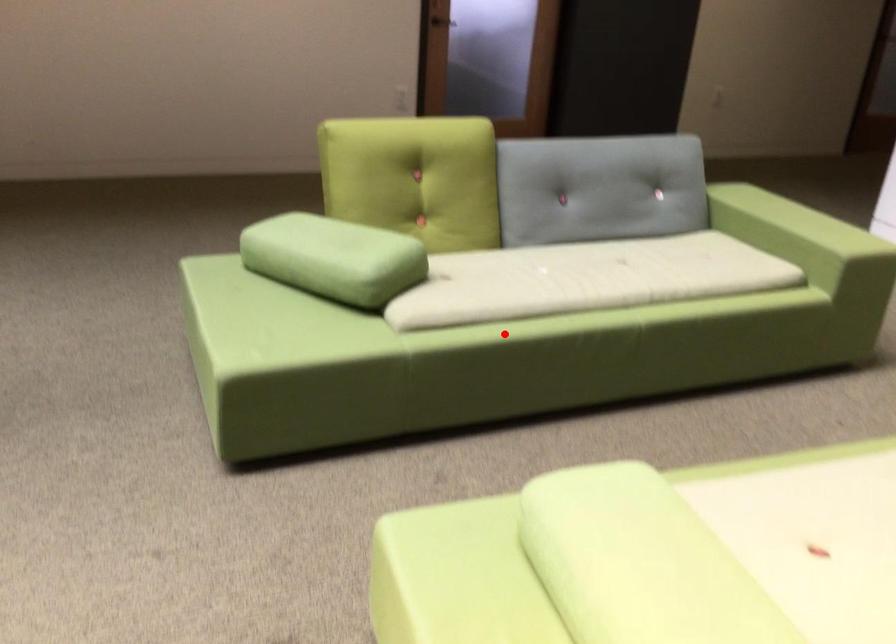
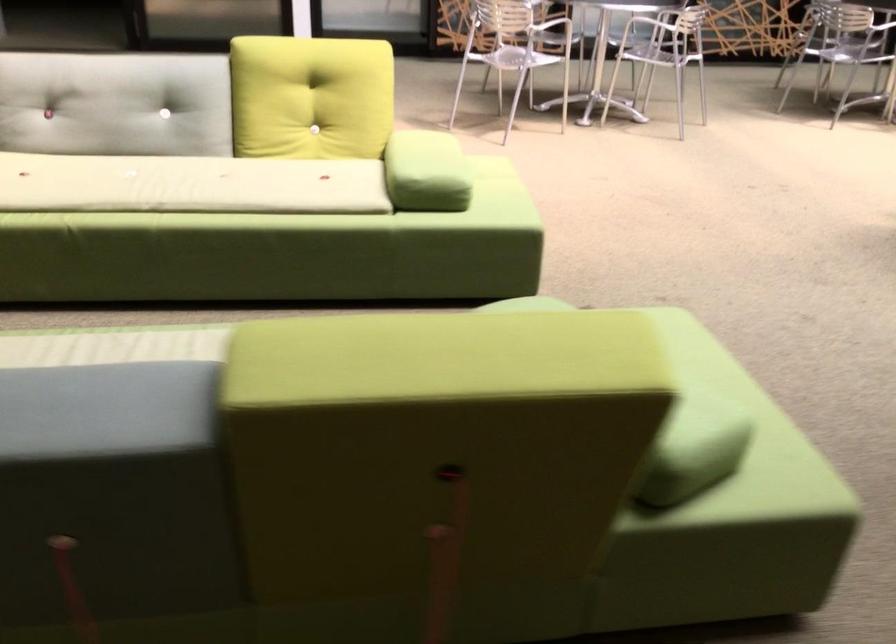
Question: I am providing you with two images of the same scene from different viewpoints. A red point is marked on the first image. Can you still see the location of the red point in image 2?

Choices:
 (A) Yes
 (B) No

Answer: (B)